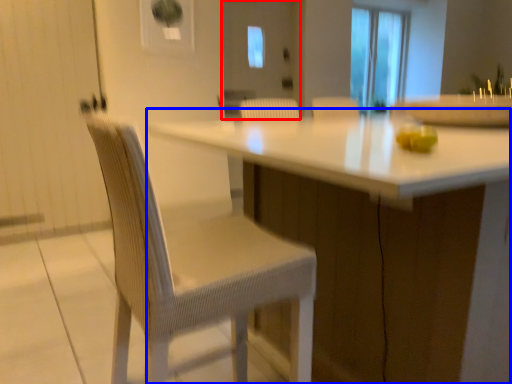
Question: Which of the following is the farthest to the observer, screen door (highlighted by a red box) or table (highlighted by a blue box)?

Choices:
 (A) screen door
 (B) table

Answer: (A)